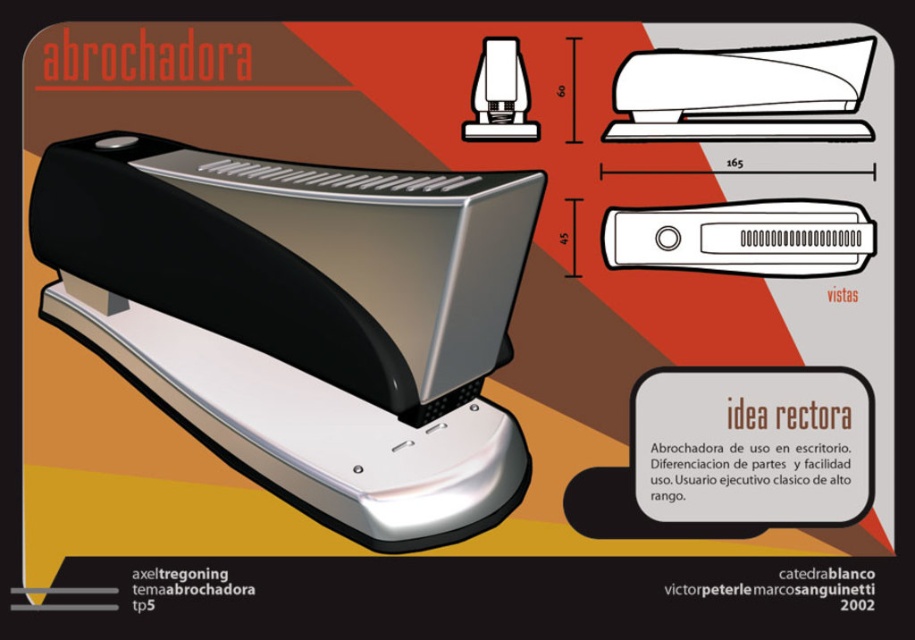
Which is below, matte black stapler at center or matte black stapler at upper center?

matte black stapler at center

Does matte black stapler at center have a lesser width compared to matte black stapler at upper center?

Incorrect, matte black stapler at center's width is not less than matte black stapler at upper center's.

Between point (100, 209) and point (494, 67), which one is positioned behind?

The point (494, 67) is behind.

In order to click on matte black stapler at center in this screenshot , I will do `click(303, 321)`.

Based on the photo, who is positioned more to the left, white plastic stapler at center or matte black stapler at upper center?

matte black stapler at upper center

Between white plastic stapler at center and matte black stapler at upper center, which one is positioned lower?

white plastic stapler at center is below.

Is point (685, 248) positioned before point (476, 129)?

Yes, point (685, 248) is in front of point (476, 129).

This screenshot has height=640, width=915. What are the coordinates of `white plastic stapler at center` in the screenshot? It's located at (741, 237).

Can you confirm if matte black stapler at center is thinner than white plastic stapler at upper center?

No.

Is matte black stapler at center shorter than white plastic stapler at upper center?

Incorrect, matte black stapler at center's height does not fall short of white plastic stapler at upper center's.

The width and height of the screenshot is (915, 640). What do you see at coordinates (303, 321) in the screenshot?
I see `matte black stapler at center` at bounding box center [303, 321].

The image size is (915, 640). I want to click on matte black stapler at center, so click(303, 321).